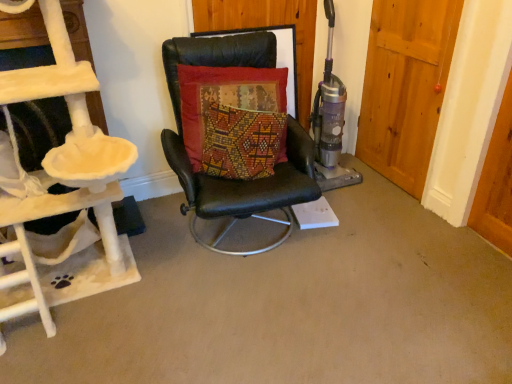
Where is `free space in front of black leather chair at center`? Image resolution: width=512 pixels, height=384 pixels. free space in front of black leather chair at center is located at coordinates (251, 317).